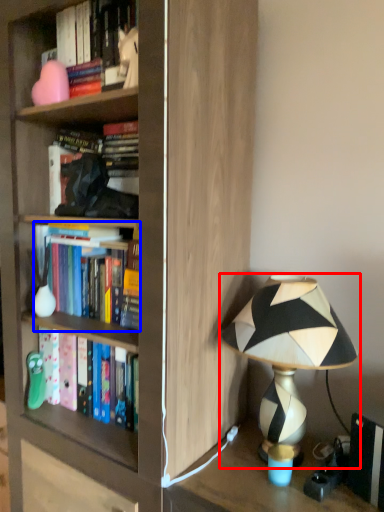
Question: Which object appears closest to the camera in this image, lamp (highlighted by a red box) or book (highlighted by a blue box)?

Choices:
 (A) lamp
 (B) book

Answer: (A)